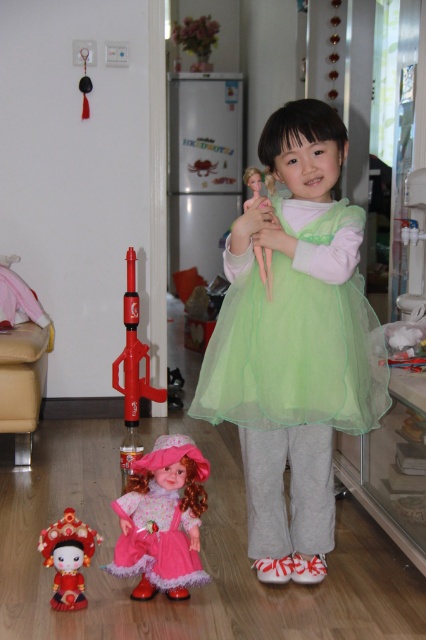
You are a toy organizer trying to place the green tulle dress at center and the pink fabric doll at lower center into a storage box. The box can only fit items that are narrower than 12 inches. Based on the scene, can both items fit in the box?

The green tulle dress at center is wider than the pink fabric doll at lower center. Since the box requires items narrower than 12 inches, we need to check both widths. However, without exact measurements, we can only state their relative sizes. If the pink doll is under 12 inches, the green dress might exceed it due to being wider. Consult exact measurements for certainty.